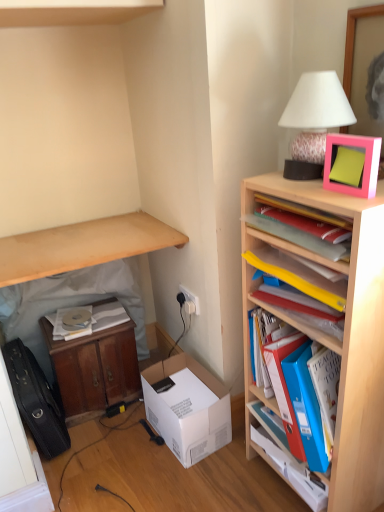
Where is `blank space above wooden cabinet at lower left, which is counted as the second table, starting from the left (from a real-world perspective)`? This screenshot has width=384, height=512. blank space above wooden cabinet at lower left, which is counted as the second table, starting from the left (from a real-world perspective) is located at coordinates (102, 326).